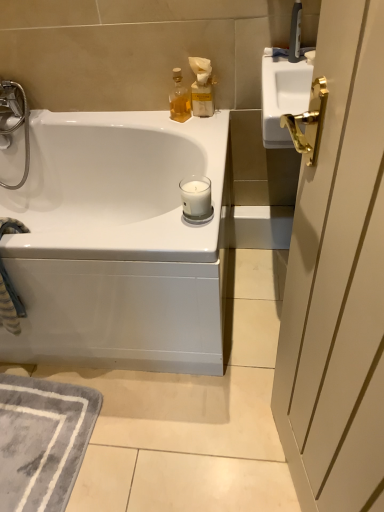
Locate an element on the screen. The image size is (384, 512). blank space to the left of translucent glass bottle at upper center is located at coordinates (150, 119).